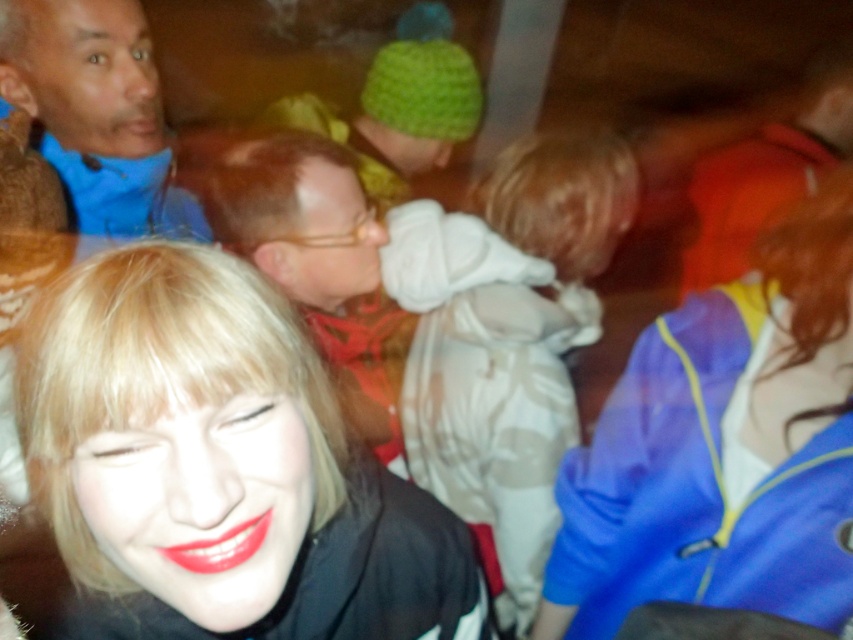
Question: Is shiny black jacket at lower left bigger than blue fabric jacket at right?

Choices:
 (A) yes
 (B) no

Answer: (B)

Question: Which point is farther to the camera?

Choices:
 (A) blue fleece jacket at upper left
 (B) shiny black jacket at lower left

Answer: (A)

Question: Which of the following is the farthest from the observer?

Choices:
 (A) (670, 493)
 (B) (96, 154)

Answer: (B)

Question: Does shiny black jacket at lower left have a greater width compared to blue fleece jacket at upper left?

Choices:
 (A) yes
 (B) no

Answer: (A)

Question: Which of the following is the closest to the observer?

Choices:
 (A) shiny black jacket at lower left
 (B) white cotton hoodie at center
 (C) blue fleece jacket at upper left
 (D) blue fabric jacket at right

Answer: (A)

Question: Where is shiny black jacket at lower left located in relation to white cotton hoodie at center in the image?

Choices:
 (A) above
 (B) below

Answer: (B)